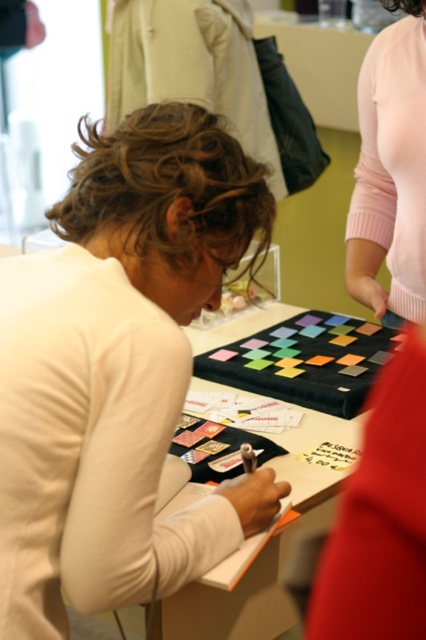
Is point (250, 211) behind point (354, 458)?

That is False.

Is matte white shirt at center positioned before black fabric at center?

Yes, it is.

Does point (28, 582) come farther from viewer compared to point (293, 312)?

No.

This screenshot has width=426, height=640. I want to click on matte white shirt at center, so click(118, 371).

Who is higher up, matte white shirt at center or pink sweater at upper right?

pink sweater at upper right

Is matte white shirt at center thinner than pink sweater at upper right?

No.

Is point (68, 417) more distant than point (377, 124)?

No, (68, 417) is in front of (377, 124).

Find the location of a particular element. matte white shirt at center is located at coordinates (118, 371).

Who is more distant from viewer, (362, 179) or (336, 492)?

Positioned behind is point (362, 179).

Is pink sweater at upper right above black fabric at center?

Yes.

The width and height of the screenshot is (426, 640). What are the coordinates of `pink sweater at upper right` in the screenshot? It's located at (391, 170).